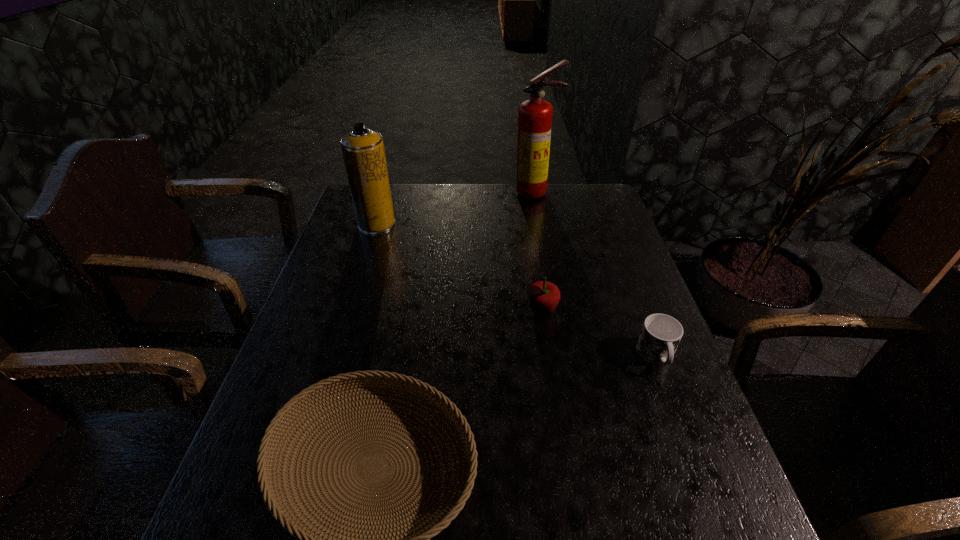
The height and width of the screenshot is (540, 960). I want to click on vacant space located 0.150m on the front of the third nearest object, so (551, 369).

At what (x,y) coordinates should I click in order to perform the action: click on vacant area located 0.310m on the side of the cup with the handle. Please return your answer as a coordinate pair (x, y). Looking at the image, I should click on (719, 522).

Find the location of a particular element. fire extinguisher that is at the far edge is located at coordinates (534, 115).

Locate an element on the screen. The width and height of the screenshot is (960, 540). aerosol can located at the far edge is located at coordinates (363, 151).

You are a GUI agent. You are given a task and a screenshot of the screen. Output one action in this format:
    pyautogui.click(x=<x>, y=<y>)
    Task: Click on the object positioned at the left edge
    Image resolution: width=960 pixels, height=540 pixels.
    Given the screenshot: What is the action you would take?
    pyautogui.click(x=363, y=151)

Where is `object at the right edge`? object at the right edge is located at coordinates (660, 335).

Locate an element on the screen. This screenshot has height=540, width=960. object positioned at the far left corner is located at coordinates (363, 151).

Find the location of a particular element. Image resolution: width=960 pixels, height=540 pixels. vacant area at the left edge is located at coordinates (351, 232).

The image size is (960, 540). What are the coordinates of `free space at the right edge` in the screenshot? It's located at (612, 249).

Where is `vacant region at the far left corner of the desktop`? vacant region at the far left corner of the desktop is located at coordinates (349, 208).